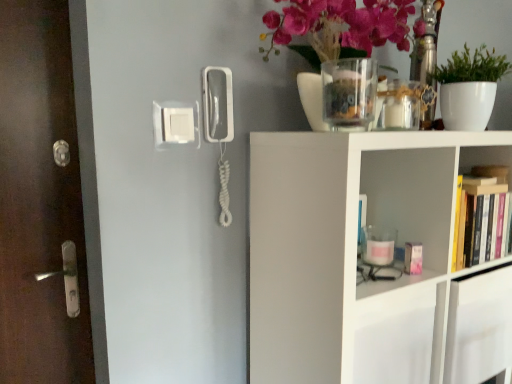
Question: Would you say white plastic phone at center is a long distance from hardcover books at right, the first shelf viewed from the top?

Choices:
 (A) yes
 (B) no

Answer: (B)

Question: Is white plastic phone at center positioned with its back to hardcover books at right, which is counted as the second shelf, starting from the bottom?

Choices:
 (A) yes
 (B) no

Answer: (B)

Question: Is white plastic phone at center positioned behind hardcover books at right, which is counted as the second shelf, starting from the bottom?

Choices:
 (A) no
 (B) yes

Answer: (A)

Question: Can you confirm if white plastic phone at center is thinner than hardcover books at right, which is counted as the second shelf, starting from the bottom?

Choices:
 (A) no
 (B) yes

Answer: (B)

Question: From a real-world perspective, is white plastic phone at center located beneath hardcover books at right, the first shelf viewed from the top?

Choices:
 (A) yes
 (B) no

Answer: (B)

Question: Is white plastic phone at center at the right side of hardcover books at right, the first shelf viewed from the top?

Choices:
 (A) no
 (B) yes

Answer: (A)

Question: Is hardcover books at right, the first shelf viewed from the top, facing away from clear glass vase at upper center?

Choices:
 (A) yes
 (B) no

Answer: (B)

Question: Is hardcover books at right, which is counted as the second shelf, starting from the bottom, surrounding clear glass vase at upper center?

Choices:
 (A) no
 (B) yes

Answer: (A)

Question: From the image's perspective, would you say hardcover books at right, which is counted as the second shelf, starting from the bottom, is shown under clear glass vase at upper center?

Choices:
 (A) yes
 (B) no

Answer: (A)

Question: Considering the relative sizes of hardcover books at right, the first shelf viewed from the top, and clear glass vase at upper center in the image provided, is hardcover books at right, the first shelf viewed from the top, thinner than clear glass vase at upper center?

Choices:
 (A) yes
 (B) no

Answer: (A)

Question: Is the surface of hardcover books at right, the first shelf viewed from the top, in direct contact with clear glass vase at upper center?

Choices:
 (A) no
 (B) yes

Answer: (A)

Question: Considering the relative sizes of matte glass vase at upper center and white matte plant at upper right in the image provided, is matte glass vase at upper center thinner than white matte plant at upper right?

Choices:
 (A) yes
 (B) no

Answer: (B)